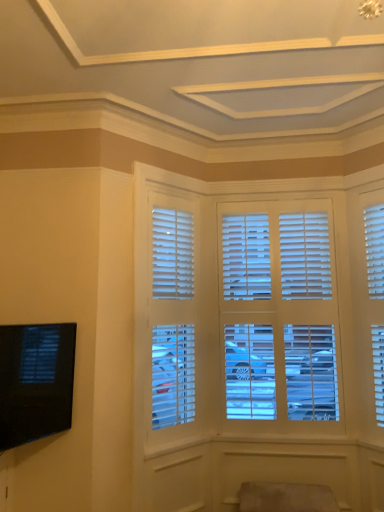
Question: Does white matte blinds at center contain black glossy tv at lower left?

Choices:
 (A) no
 (B) yes

Answer: (A)

Question: Does white matte blinds at center appear on the left side of black glossy tv at lower left?

Choices:
 (A) no
 (B) yes

Answer: (A)

Question: Does white matte blinds at center appear on the right side of black glossy tv at lower left?

Choices:
 (A) yes
 (B) no

Answer: (A)

Question: Is white matte blinds at center bigger than black glossy tv at lower left?

Choices:
 (A) yes
 (B) no

Answer: (A)

Question: Considering the relative sizes of white matte blinds at center and black glossy tv at lower left in the image provided, is white matte blinds at center smaller than black glossy tv at lower left?

Choices:
 (A) no
 (B) yes

Answer: (A)

Question: In terms of width, does suede-like beige swivel chair at lower center look wider or thinner when compared to black glossy tv at lower left?

Choices:
 (A) wide
 (B) thin

Answer: (A)

Question: Considering the positions of suede-like beige swivel chair at lower center and black glossy tv at lower left in the image, is suede-like beige swivel chair at lower center bigger or smaller than black glossy tv at lower left?

Choices:
 (A) small
 (B) big

Answer: (B)

Question: Considering the positions of suede-like beige swivel chair at lower center and black glossy tv at lower left in the image, is suede-like beige swivel chair at lower center taller or shorter than black glossy tv at lower left?

Choices:
 (A) short
 (B) tall

Answer: (A)

Question: In the image, is suede-like beige swivel chair at lower center on the left side or the right side of black glossy tv at lower left?

Choices:
 (A) right
 (B) left

Answer: (A)

Question: Is black glossy tv at lower left inside the boundaries of white matte blinds at center, or outside?

Choices:
 (A) outside
 (B) inside

Answer: (A)

Question: Is black glossy tv at lower left bigger or smaller than white matte blinds at center?

Choices:
 (A) small
 (B) big

Answer: (A)

Question: Looking at their shapes, would you say black glossy tv at lower left is wider or thinner than white matte blinds at center?

Choices:
 (A) wide
 (B) thin

Answer: (B)

Question: From a real-world perspective, is black glossy tv at lower left physically located above or below white matte blinds at center?

Choices:
 (A) above
 (B) below

Answer: (B)

Question: Is point (178, 308) closer or farther from the camera than point (241, 505)?

Choices:
 (A) closer
 (B) farther

Answer: (B)

Question: From their relative heights in the image, would you say white matte blinds at center is taller or shorter than suede-like beige swivel chair at lower center?

Choices:
 (A) tall
 (B) short

Answer: (A)